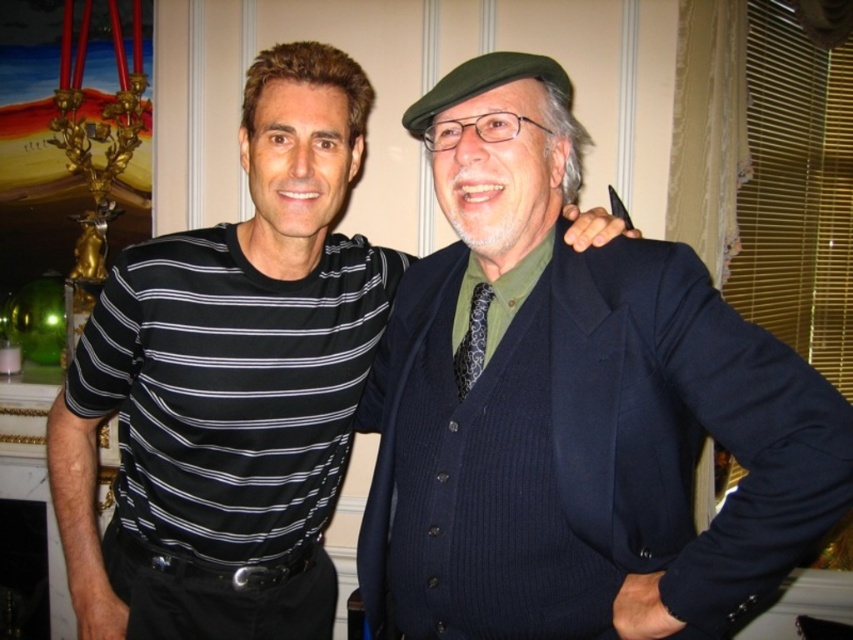
Between point (442, 442) and point (125, 310), which one is positioned behind?

The point (125, 310) is more distant.

Is dark blue textured suit at center closer to camera compared to black striped shirt at center?

Yes.

Who is more forward, (772, 362) or (357, 324)?

Positioned in front is point (772, 362).

The height and width of the screenshot is (640, 853). Identify the location of dark blue textured suit at center. (572, 406).